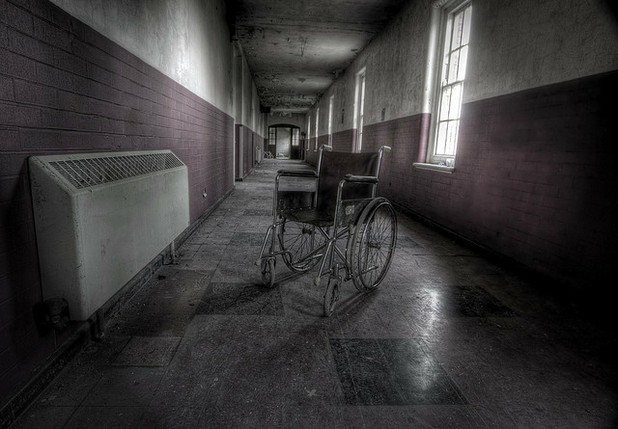
Where is `windows`? This screenshot has height=429, width=618. windows is located at coordinates click(449, 138), click(360, 114), click(328, 119), click(316, 127), click(309, 132).